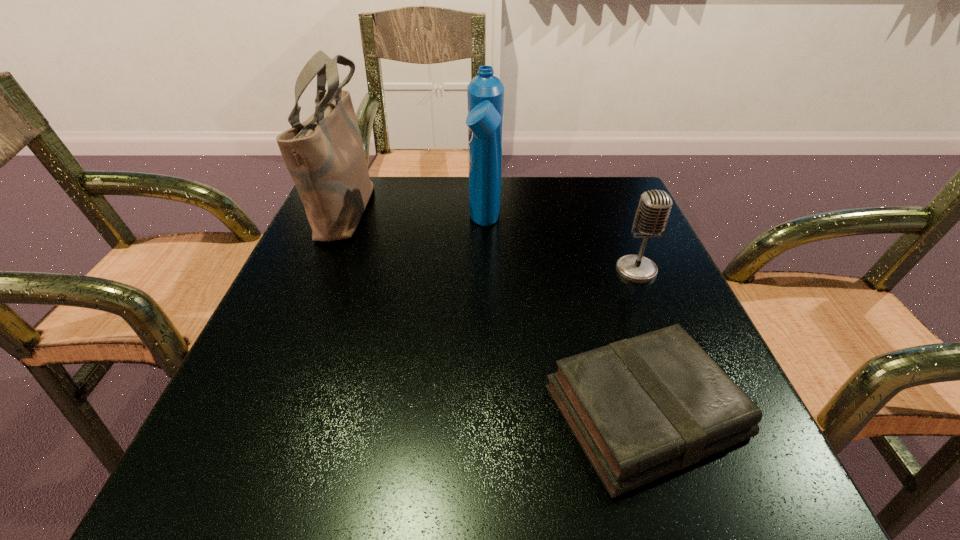
At what (x,y) coordinates should I click in order to perform the action: click on the leftmost object. Please return your answer as a coordinate pair (x, y). Looking at the image, I should click on (325, 156).

What are the coordinates of `the third object from right to left` in the screenshot? It's located at (485, 93).

Locate an element on the screen. This screenshot has height=540, width=960. the second shortest object is located at coordinates (654, 208).

What are the coordinates of `microphone` in the screenshot? It's located at (654, 208).

Image resolution: width=960 pixels, height=540 pixels. What are the coordinates of `the shortest object` in the screenshot? It's located at tap(640, 408).

Identify the location of book. This screenshot has height=540, width=960. (640, 408).

You are a GUI agent. You are given a task and a screenshot of the screen. Output one action in this format:
    pyautogui.click(x=<x>, y=<y>)
    Task: Click on the blank area located 0.160m on the front-facing side of the shoulder bag
    The image size is (960, 540).
    Given the screenshot: What is the action you would take?
    pyautogui.click(x=443, y=207)

Where is `free point located on the left of the shampoo`? free point located on the left of the shampoo is located at coordinates (312, 224).

The width and height of the screenshot is (960, 540). Identify the location of vacant region located 0.390m on the left of the third farthest object. (418, 270).

At what (x,y) coordinates should I click in order to perform the action: click on vacant area situated on the left of the nearest object. Please return your answer as a coordinate pair (x, y). The width and height of the screenshot is (960, 540). Looking at the image, I should click on (367, 411).